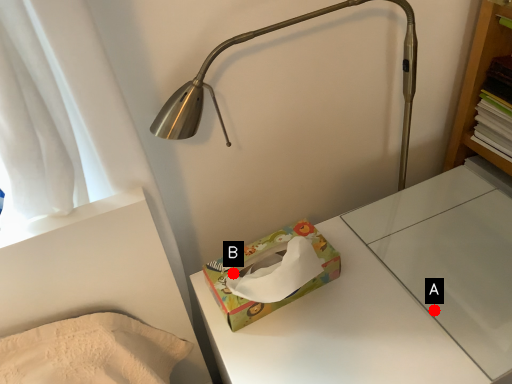
Question: Two points are circled on the image, labeled by A and B beside each circle. Which point is closer to the camera taking this photo?

Choices:
 (A) A is closer
 (B) B is closer

Answer: (A)